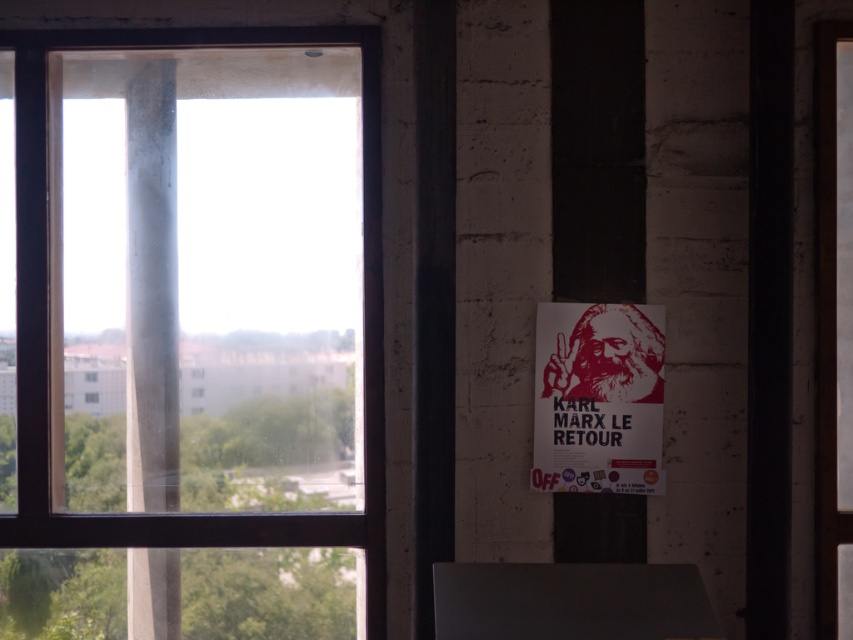
You are a delivery person carrying a package that is 20 inches wide. You need to pass through the space between the transparent glass window at left and the red matte poster at right. Is there enough space for your package to fit through?

The distance between the transparent glass window at left and the red matte poster at right is 18.03 inches, which is narrower than the 20 inches width of the package. Therefore, the package cannot fit through the space between them.

You are standing in the room and want to place a small plant pot exactly at the center of the gray concrete pillar at center. Where should you place the pot?

The gray concrete pillar at center is located at point (151, 289), so you should place the small plant pot at that exact coordinate to center it.

You are an interior designer planning to install a new piece of furniture in the office. The furniture requires a space larger than the transparent glass window at left. Can the gray concrete pillar at center accommodate it?

The transparent glass window at left has a larger size compared to the gray concrete pillar at center, so the gray concrete pillar at center is smaller and cannot accommodate the furniture that requires a space larger than the window.